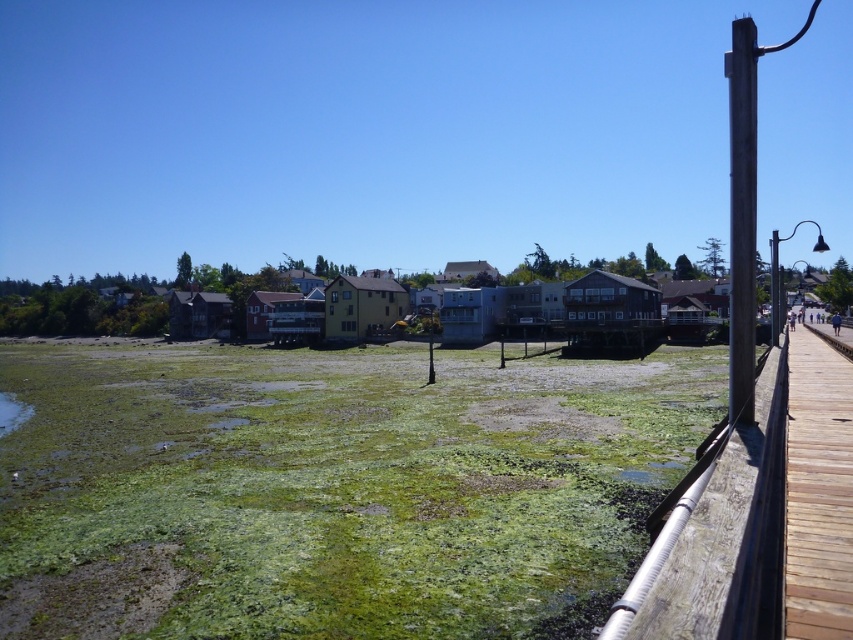
You are standing at the point marked as point [759,520]. What object is located at that point?

The point [759,520] indicates a wooden dock at right.

You are a construction worker inspecting the wooden structures along the boardwalk. You notice two wooden posts at the right side of the boardwalk. Which one is thinner between the wooden at right and the brown wooden post at right?

The wooden at right is thinner than the brown wooden post at right according to the description.

You are standing on the boardwalk and want to take a photo of the wooden at right and the brown wooden post at right. Which object will appear closer to you in the photo?

The wooden at right will appear closer to you in the photo because it is positioned in front of the brown wooden post at right.